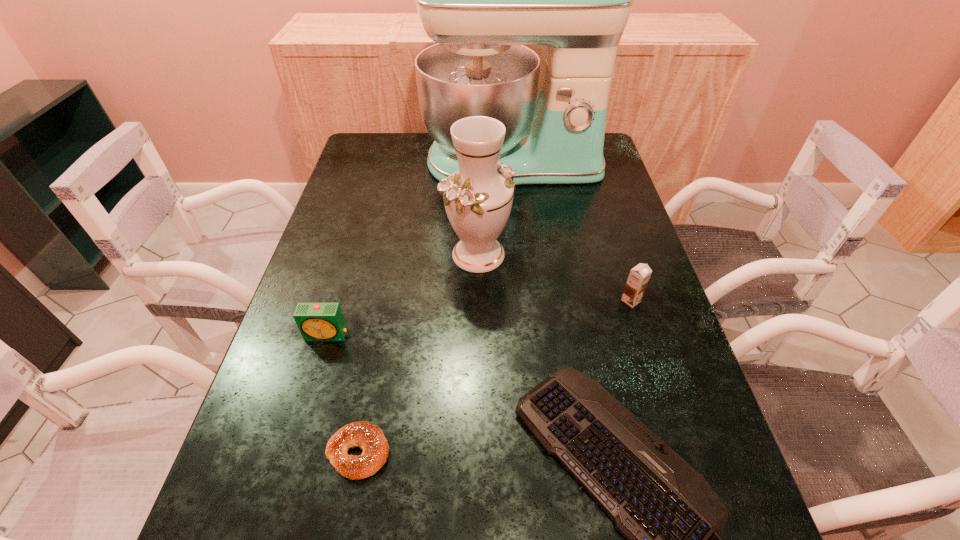
Image resolution: width=960 pixels, height=540 pixels. In order to click on free space at the left edge of the desktop in this screenshot , I will do coord(378,231).

At what (x,y) coordinates should I click in order to perform the action: click on vacant region at the right edge. Please return your answer as a coordinate pair (x, y). The height and width of the screenshot is (540, 960). Looking at the image, I should click on (617, 247).

Find the location of a particular element. The image size is (960, 540). vacant area at the far left corner of the desktop is located at coordinates (387, 165).

Find the location of a particular element. The image size is (960, 540). free spot between the vase and the fourth tallest object is located at coordinates (402, 295).

I want to click on vacant area that lies between the bagel and the third tallest object, so click(x=494, y=376).

In order to click on free space between the bagel and the mixer in this screenshot , I will do `click(436, 308)`.

What are the coordinates of `the closest object to the tallest object` in the screenshot? It's located at point(478,198).

Locate an element on the screen. object that is the closest to the fifth nearest object is located at coordinates (481, 0).